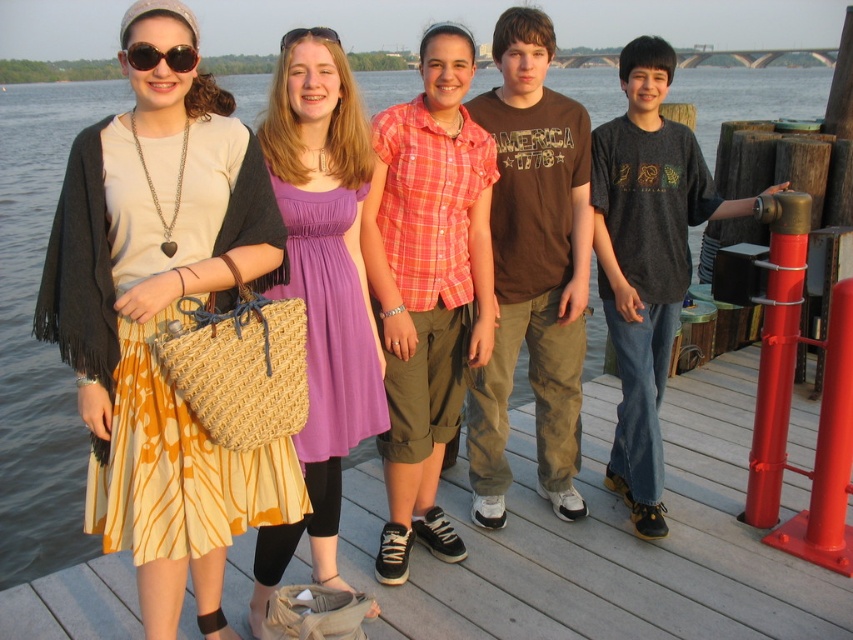
You are standing on the wooden dock and want to greet the person wearing the purple satin dress at center. Which direction should you walk to approach them from the brown cotton shirt at center?

The brown cotton shirt at center is to the right of the purple satin dress at center, so to approach the purple satin dress at center from the brown cotton shirt at center, you should walk to the left.

You are trying to determine the spatial relationship between the printed fabric skirt at left and the wooden deck at center. Which object is wider?

The printed fabric skirt at left is narrower than the wooden deck at center since its width is less than the deck.